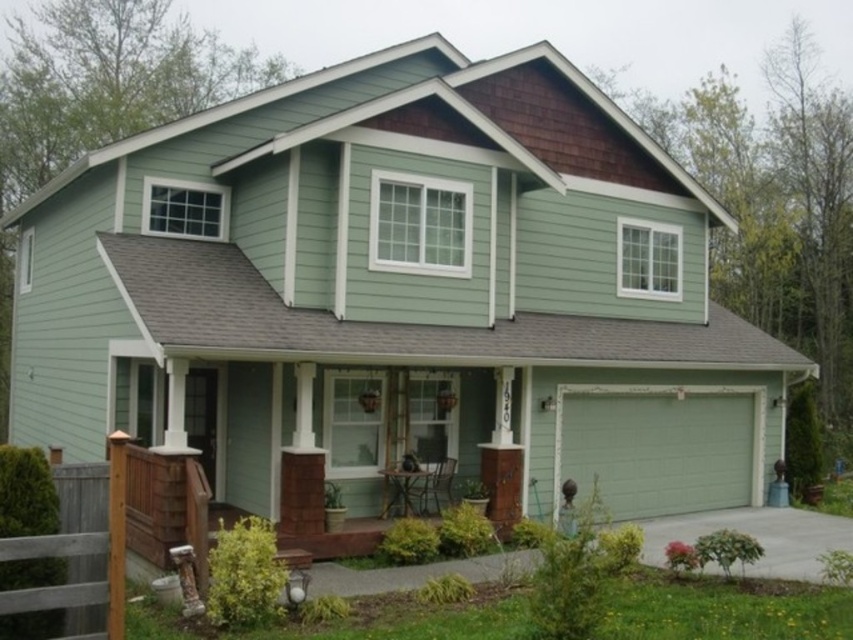
Question: Is green smooth garage door at lower right above brown wooden fence at lower left?

Choices:
 (A) no
 (B) yes

Answer: (A)

Question: Is green smooth garage door at lower right below brown wooden fence at lower left?

Choices:
 (A) no
 (B) yes

Answer: (B)

Question: Is green smooth garage door at lower right to the right of brown wooden fence at lower left from the viewer's perspective?

Choices:
 (A) no
 (B) yes

Answer: (B)

Question: Which point appears closest to the camera in this image?

Choices:
 (A) (x=718, y=394)
 (B) (x=74, y=518)

Answer: (B)